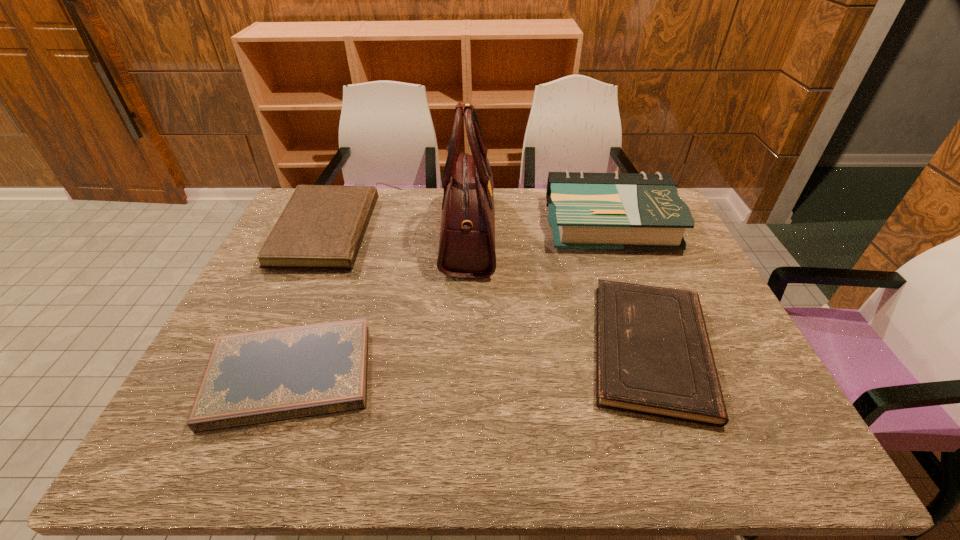
Identify the location of the tallest object. This screenshot has height=540, width=960. click(x=467, y=235).

You are a GUI agent. You are given a task and a screenshot of the screen. Output one action in this format:
    pyautogui.click(x=<x>, y=<y>)
    Task: Click on the third object from right to left
    The image size is (960, 540).
    Given the screenshot: What is the action you would take?
    pyautogui.click(x=467, y=235)

Where is `the fourth shortest object`? This screenshot has width=960, height=540. the fourth shortest object is located at coordinates (642, 211).

At what (x,y) coordinates should I click in order to perform the action: click on the third shortest paperback book. Please return your answer as a coordinate pair (x, y). The height and width of the screenshot is (540, 960). Looking at the image, I should click on (321, 227).

Find the location of a particular element. vacant space located on the front-facing side of the third object from left to right is located at coordinates (526, 234).

The image size is (960, 540). Identify the location of vacant space located on the left of the second tallest object. (502, 224).

Locate an element on the screen. free location located on the spine side of the third shortest paperback book is located at coordinates (504, 231).

Identify the location of handbag present at the far edge. (467, 235).

Where is `object that is positioned at the far left corner`? The width and height of the screenshot is (960, 540). object that is positioned at the far left corner is located at coordinates (321, 227).

Where is `object located in the near left corner section of the desktop`? The height and width of the screenshot is (540, 960). object located in the near left corner section of the desktop is located at coordinates [x=256, y=377].